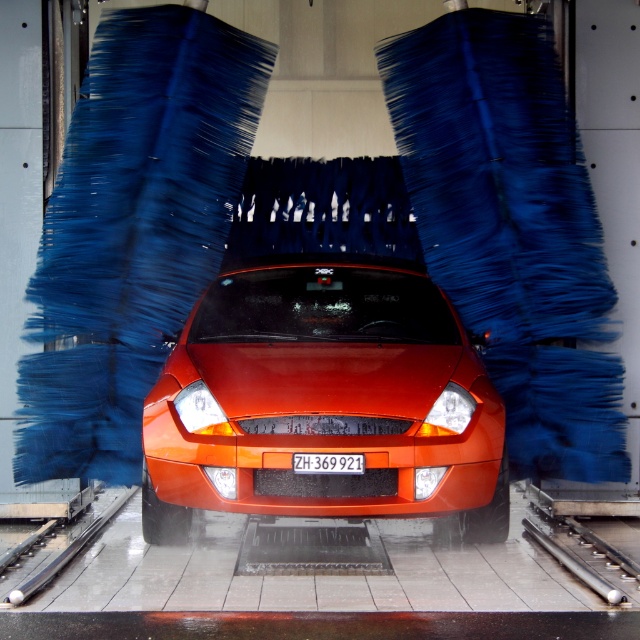
Can you confirm if orange matte car at center is shorter than white plastic license plate at center?

No, orange matte car at center is not shorter than white plastic license plate at center.

Which is above, orange matte car at center or white plastic license plate at center?

orange matte car at center

Which is behind, point (416, 445) or point (353, 470)?

Point (416, 445)

The width and height of the screenshot is (640, 640). Find the location of `orange matte car at center`. orange matte car at center is located at coordinates (323, 403).